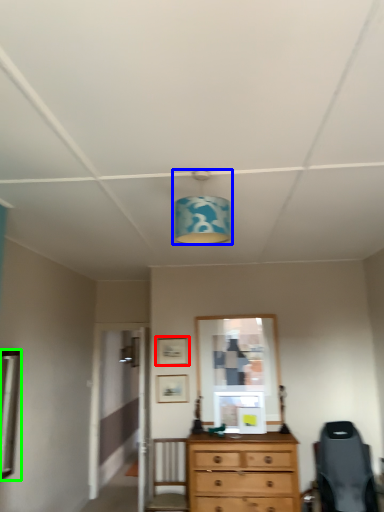
Question: Which is nearer to the picture frame (highlighted by a red box)? light fixture (highlighted by a blue box) or mirror (highlighted by a green box).

Choices:
 (A) light fixture
 (B) mirror

Answer: (B)